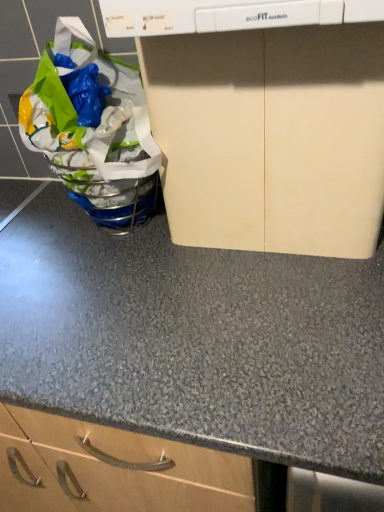
Question: Considering the relative sizes of beige matte cabinet at upper center and translucent plastic grocery bag at left in the image provided, is beige matte cabinet at upper center thinner than translucent plastic grocery bag at left?

Choices:
 (A) yes
 (B) no

Answer: (A)

Question: Is beige matte cabinet at upper center further to the viewer compared to translucent plastic grocery bag at left?

Choices:
 (A) yes
 (B) no

Answer: (B)

Question: Is beige matte cabinet at upper center aimed at translucent plastic grocery bag at left?

Choices:
 (A) yes
 (B) no

Answer: (B)

Question: Considering the relative sizes of beige matte cabinet at upper center and translucent plastic grocery bag at left in the image provided, is beige matte cabinet at upper center bigger than translucent plastic grocery bag at left?

Choices:
 (A) yes
 (B) no

Answer: (A)

Question: From the image's perspective, is beige matte cabinet at upper center beneath translucent plastic grocery bag at left?

Choices:
 (A) yes
 (B) no

Answer: (A)

Question: Considering the relative sizes of beige matte cabinet at upper center and translucent plastic grocery bag at left in the image provided, is beige matte cabinet at upper center wider than translucent plastic grocery bag at left?

Choices:
 (A) no
 (B) yes

Answer: (A)

Question: Could you tell me if translucent plastic grocery bag at left is facing beige matte cabinet at upper center?

Choices:
 (A) yes
 (B) no

Answer: (B)

Question: Would you say translucent plastic grocery bag at left is a long distance from beige matte cabinet at upper center?

Choices:
 (A) yes
 (B) no

Answer: (B)

Question: Is the surface of translucent plastic grocery bag at left in direct contact with beige matte cabinet at upper center?

Choices:
 (A) no
 (B) yes

Answer: (A)

Question: Does translucent plastic grocery bag at left appear on the right side of beige matte cabinet at upper center?

Choices:
 (A) yes
 (B) no

Answer: (B)

Question: From the image's perspective, would you say translucent plastic grocery bag at left is positioned over beige matte cabinet at upper center?

Choices:
 (A) yes
 (B) no

Answer: (A)

Question: Would you say translucent plastic grocery bag at left is outside beige matte cabinet at upper center?

Choices:
 (A) no
 (B) yes

Answer: (B)

Question: From the image's perspective, relative to beige matte cabinet at upper center, is translucent plastic grocery bag at left above or below?

Choices:
 (A) above
 (B) below

Answer: (A)